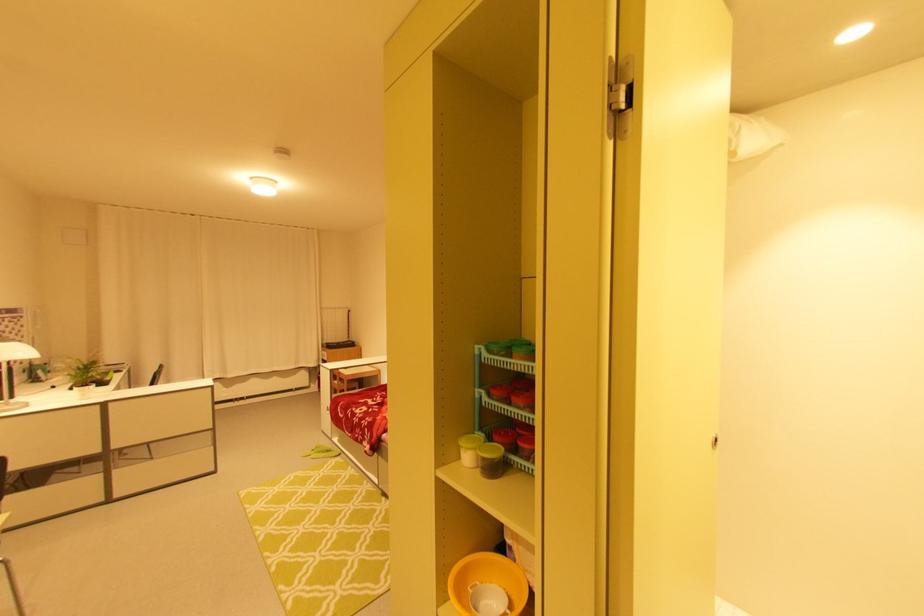
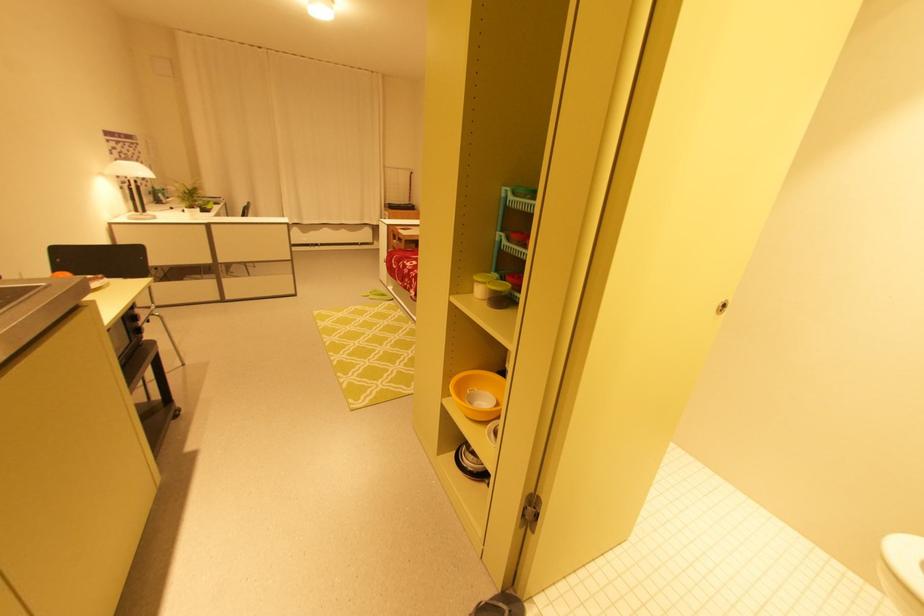
Find the pixel in the second image that matches pixel 482 583 in the first image.

(480, 390)